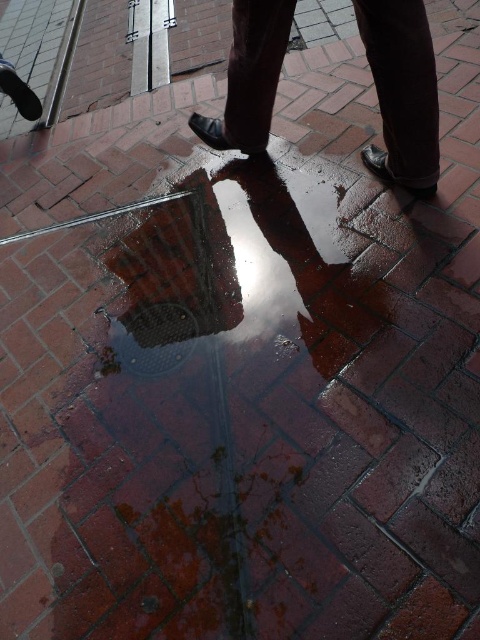
Between point (251, 291) and point (250, 132), which one is positioned behind?

Positioned behind is point (250, 132).

Is metallic grid at center thinner than dark brown leather shoes at center?

No.

Between point (252, 204) and point (399, 179), which one is positioned behind?

The point (252, 204) is behind.

The height and width of the screenshot is (640, 480). What are the coordinates of `metallic grid at center` in the screenshot? It's located at (250, 262).